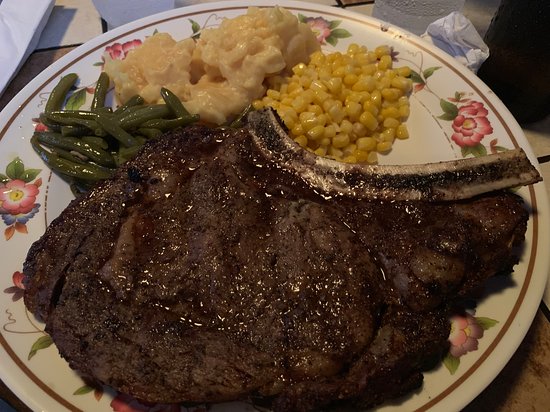
I want to click on napkin, so click(455, 58).